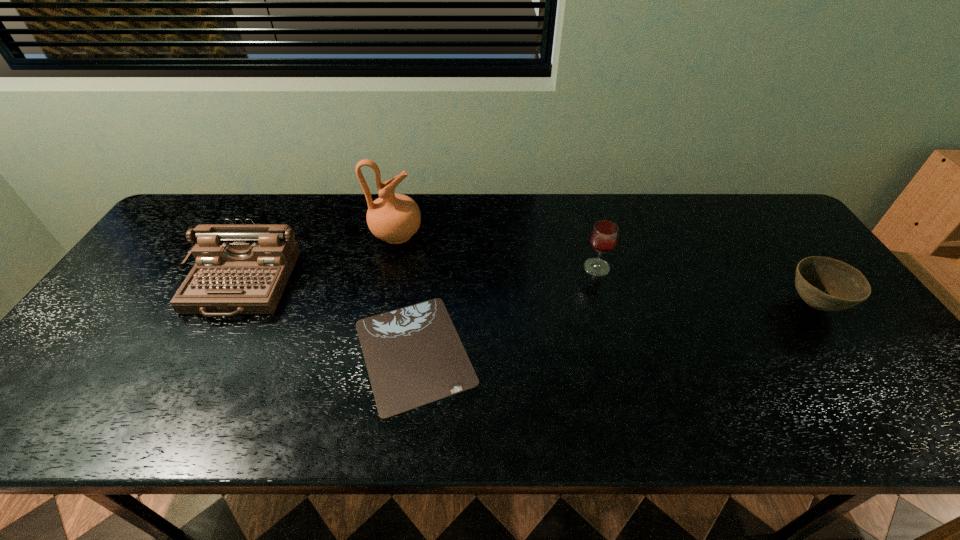
Where is `free space between the shortest object and the second object from right to left`? free space between the shortest object and the second object from right to left is located at coordinates (505, 309).

Where is `free space between the fourth tallest object and the leftmost object`? The height and width of the screenshot is (540, 960). free space between the fourth tallest object and the leftmost object is located at coordinates (527, 294).

Where is `vacant point located between the leftmost object and the mousepad`? vacant point located between the leftmost object and the mousepad is located at coordinates (327, 318).

Find the location of a particular element. This screenshot has width=960, height=540. empty space between the second object from right to left and the rightmost object is located at coordinates coord(705,286).

This screenshot has height=540, width=960. In order to click on blank region between the fourth object from left to right and the tallest object in this screenshot , I will do `click(496, 251)`.

You are a GUI agent. You are given a task and a screenshot of the screen. Output one action in this format:
    pyautogui.click(x=<x>, y=<y>)
    Task: Click on the object that ranks as the third closest to the leftmost object
    This screenshot has width=960, height=540.
    Given the screenshot: What is the action you would take?
    pyautogui.click(x=604, y=235)

Identify which object is located as the fourth nearest to the pottery. Please provide its 2D coordinates. Your answer should be formatted as a tuple, i.e. [(x, y)], where the tuple contains the x and y coordinates of a point satisfying the conditions above.

[(827, 284)]

Find the location of `blank space that satisfies the following two spatial constraints: 1. on the spout of the tallest object; 2. on the right side of the mousepad`. blank space that satisfies the following two spatial constraints: 1. on the spout of the tallest object; 2. on the right side of the mousepad is located at coordinates (372, 352).

This screenshot has width=960, height=540. I want to click on free space that satisfies the following two spatial constraints: 1. on the keyboard of the leftmost object; 2. on the left side of the mousepad, so click(204, 352).

You are a GUI agent. You are given a task and a screenshot of the screen. Output one action in this format:
    pyautogui.click(x=<x>, y=<y>)
    Task: Click on the vacant region that satisfies the following two spatial constraints: 1. on the spout of the tallest object; 2. on the right side of the wineglass
    
    Given the screenshot: What is the action you would take?
    pyautogui.click(x=390, y=267)